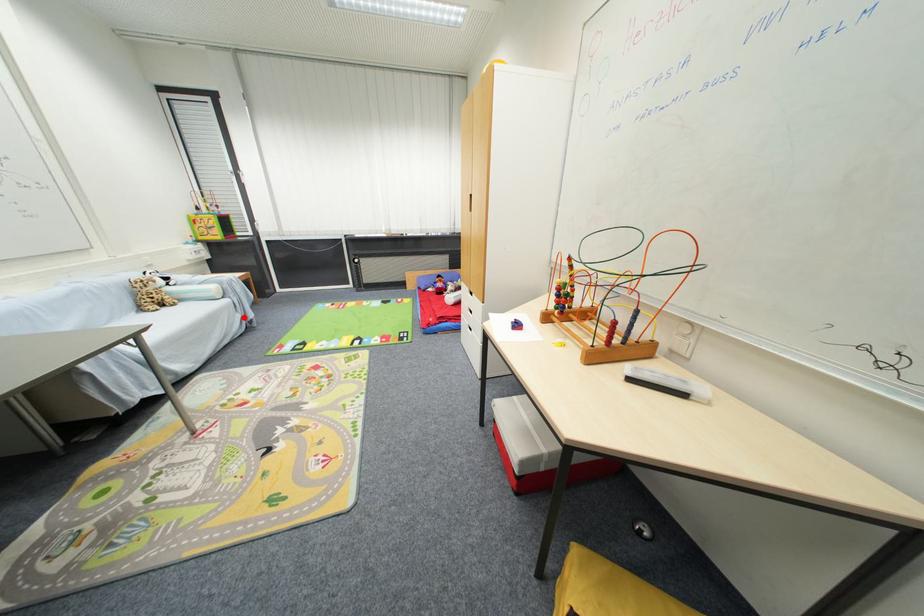
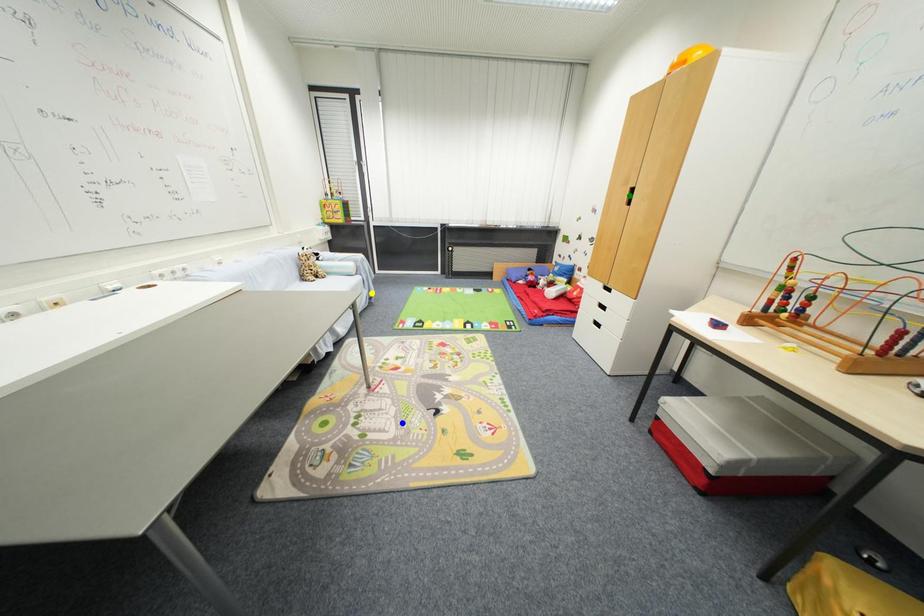
Question: I am providing you with two images of the same scene from different viewpoints. A red point is marked on the first image. You are given multiple points on the second image. Which point in image 2 is actually the same real-world point as the red point in image 1?

Choices:
 (A) yellow point
 (B) blue point
 (C) green point

Answer: (A)